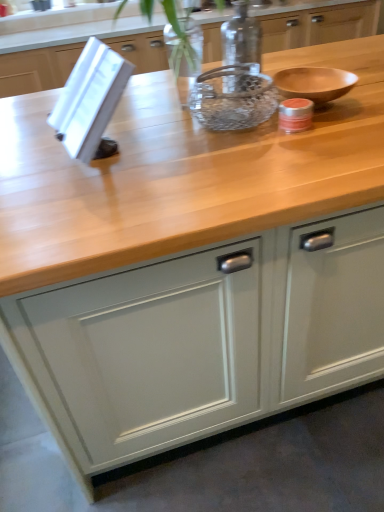
Locate an element on the screen. The image size is (384, 512). free point in front of clear glass bowl at center is located at coordinates (251, 155).